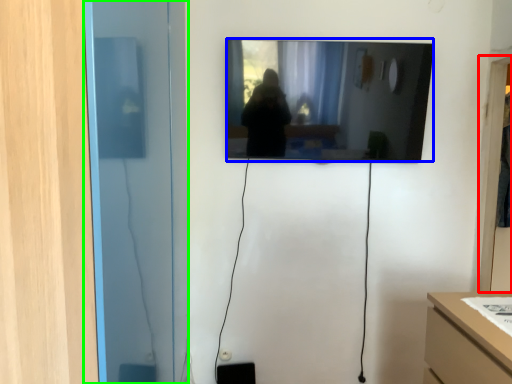
Question: Which object is positioned farthest from glass door (highlighted by a red box)? Select from mirror (highlighted by a blue box) and glass door (highlighted by a green box).

Choices:
 (A) mirror
 (B) glass door

Answer: (B)